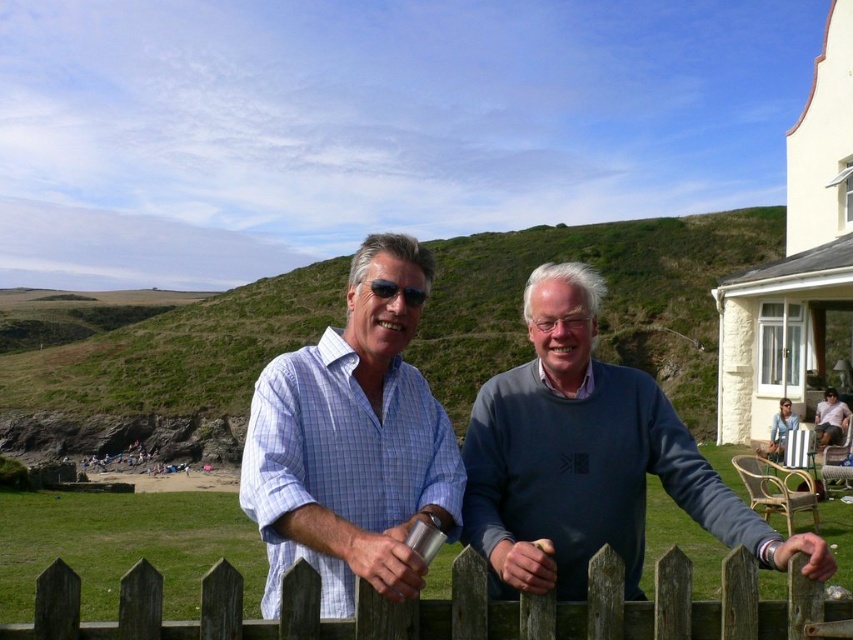
You are a photographer trying to capture the dark gray sweater at center in your shot. The camera is positioned at point A, and you can move it horizontally. The target area for the sweater is between points B and C. If the sweater is currently at coordinate 0.719 on the horizontal axis, and the target area spans from 0.6 to 0.8 on the same axis, is the sweater within the target area?

The dark gray sweater at center is located at point 0.719 on the horizontal axis, which falls within the target area between 0.6 and 0.8. Therefore, the sweater is within the desired range.

In the scene shown: You are a photographer trying to capture a photo of both the dark gray sweater at center and the blue checkered shirt at center. Since you want to ensure both are visible in the frame, which direction should you position yourself relative to the subjects?

You should position yourself to the left of the subjects so that both the dark gray sweater at center and the blue checkered shirt at center are visible in the frame. Since the dark gray sweater at center is to the right of the blue checkered shirt at center, positioning yourself to the left will allow you to capture both without one blocking the other.

You are standing in front of the wooden picket fence and want to place a small decorative rock between the two points labeled point (399, 288) and point (795, 426). Which point should the rock be closer to in order to be nearer to the viewer?

The rock should be closer to point (399, 288) because it is nearer to the viewer compared to point (795, 426).